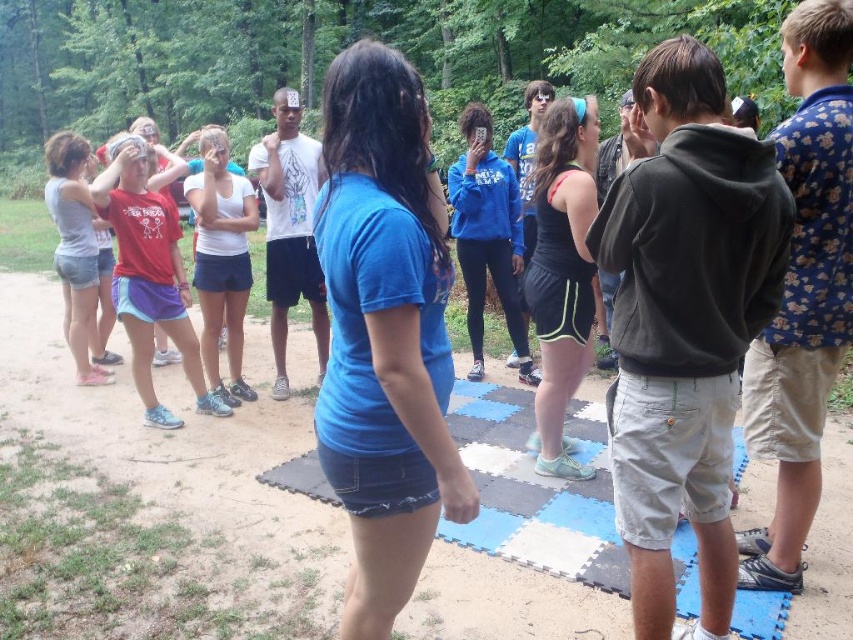
Question: Is black matte tank top at center wider than white matte shirt at center?

Choices:
 (A) no
 (B) yes

Answer: (A)

Question: Which point is farther from the camera taking this photo?

Choices:
 (A) (796, 387)
 (B) (515, 396)

Answer: (B)

Question: Which object is positioned closest to the floral-patterned shirt at right?

Choices:
 (A) blue denim shorts at center
 (B) dark gray hoodie at center-right
 (C) white matte shirt at center

Answer: (B)

Question: In this image, where is blue rubber yoga mat at center located relative to matte red t-shirt at left?

Choices:
 (A) below
 (B) above

Answer: (A)

Question: Is black matte tank top at center wider than white matte shirt at center?

Choices:
 (A) yes
 (B) no

Answer: (B)

Question: Which object is closer to the camera taking this photo?

Choices:
 (A) blue fleece jacket at center
 (B) black matte tank top at center
 (C) white matte shirt at center
 (D) matte red t-shirt at left

Answer: (B)